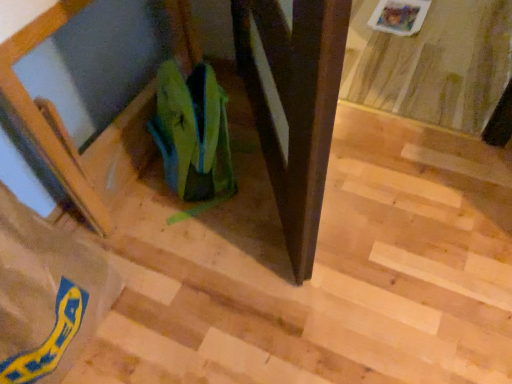
Question: Considering the positions of brown paper bag at lower left, marked as the first grocery bag in a left-to-right arrangement, and green fabric bag at center, arranged as the first grocery bag when viewed from the right, in the image, is brown paper bag at lower left, marked as the first grocery bag in a left-to-right arrangement, wider or thinner than green fabric bag at center, arranged as the first grocery bag when viewed from the right,?

Choices:
 (A) thin
 (B) wide

Answer: (B)

Question: Considering their positions, is brown paper bag at lower left, marked as the first grocery bag in a left-to-right arrangement, located in front of or behind green fabric bag at center, the 2th grocery bag viewed from the left?

Choices:
 (A) behind
 (B) front

Answer: (B)

Question: Do you think brown paper bag at lower left, marked as the first grocery bag in a left-to-right arrangement, is within green fabric bag at center, arranged as the first grocery bag when viewed from the right, or outside of it?

Choices:
 (A) inside
 (B) outside

Answer: (B)

Question: Is green fabric bag at center, arranged as the first grocery bag when viewed from the right, inside the boundaries of brown paper bag at lower left, which appears as the 2th grocery bag when viewed from the right, or outside?

Choices:
 (A) outside
 (B) inside

Answer: (A)

Question: From a real-world perspective, is green fabric bag at center, arranged as the first grocery bag when viewed from the right, physically located above or below brown paper bag at lower left, marked as the first grocery bag in a left-to-right arrangement?

Choices:
 (A) below
 (B) above

Answer: (A)

Question: Based on their sizes in the image, would you say green fabric bag at center, the 2th grocery bag viewed from the left, is bigger or smaller than brown paper bag at lower left, marked as the first grocery bag in a left-to-right arrangement?

Choices:
 (A) big
 (B) small

Answer: (B)

Question: Looking at their shapes, would you say green fabric bag at center, the 2th grocery bag viewed from the left, is wider or thinner than brown paper bag at lower left, marked as the first grocery bag in a left-to-right arrangement?

Choices:
 (A) wide
 (B) thin

Answer: (B)